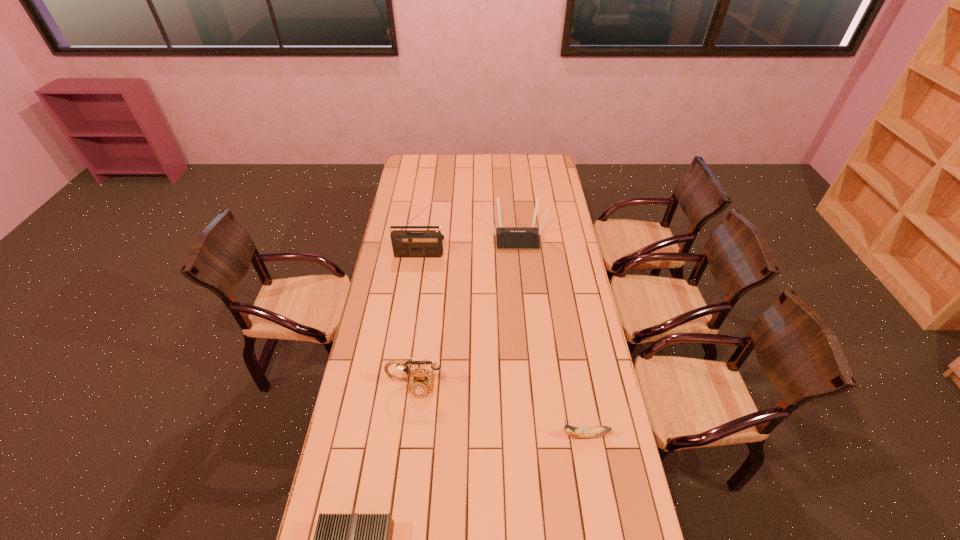
Find the location of a particular element. This screenshot has height=540, width=960. free region located 0.060m on the peel of the fourth farthest object is located at coordinates (542, 435).

You are a GUI agent. You are given a task and a screenshot of the screen. Output one action in this format:
    pyautogui.click(x=<x>, y=<y>)
    Task: Click on the blank area located 0.240m on the peel of the fourth farthest object
    Image resolution: width=960 pixels, height=540 pixels.
    Given the screenshot: What is the action you would take?
    tap(490, 435)

You are a GUI agent. You are given a task and a screenshot of the screen. Output one action in this format:
    pyautogui.click(x=<x>, y=<y>)
    Task: Click on the radio receiver located in the left edge section of the desktop
    
    Given the screenshot: What is the action you would take?
    pyautogui.click(x=406, y=243)

This screenshot has height=540, width=960. I want to click on telephone located in the left edge section of the desktop, so click(421, 381).

Where is `router at the right edge`? router at the right edge is located at coordinates (507, 237).

The height and width of the screenshot is (540, 960). Find the location of `banana that is at the right edge`. banana that is at the right edge is located at coordinates (578, 432).

Locate an element on the screen. The height and width of the screenshot is (540, 960). free location at the far edge is located at coordinates (494, 155).

Identify the location of vacant space at the left edge of the desktop. (x=383, y=257).

Find the location of `vacant space at the right edge of the desktop`. vacant space at the right edge of the desktop is located at coordinates (543, 211).

The width and height of the screenshot is (960, 540). In order to click on free space between the fourth shortest object and the third shortest object in this screenshot , I will do `click(466, 312)`.